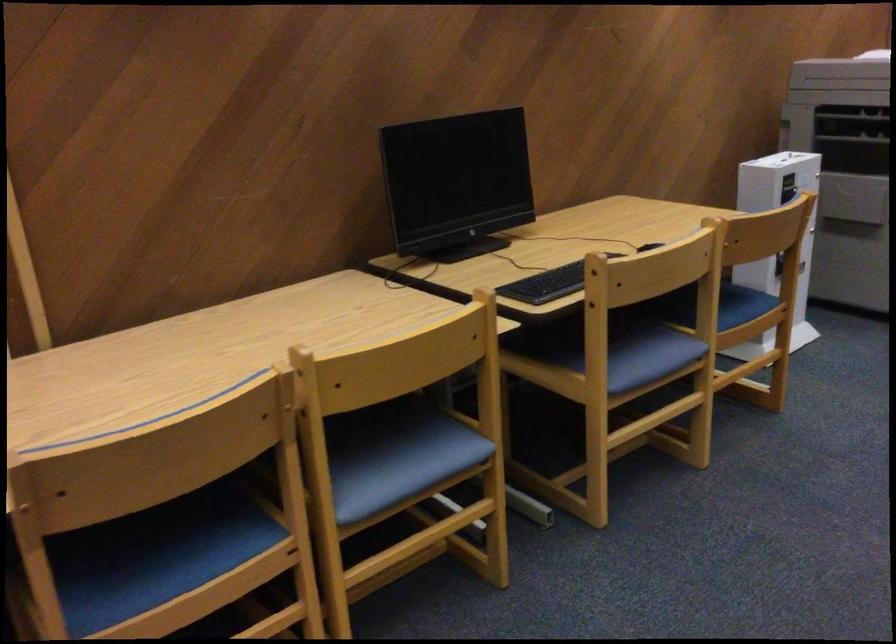
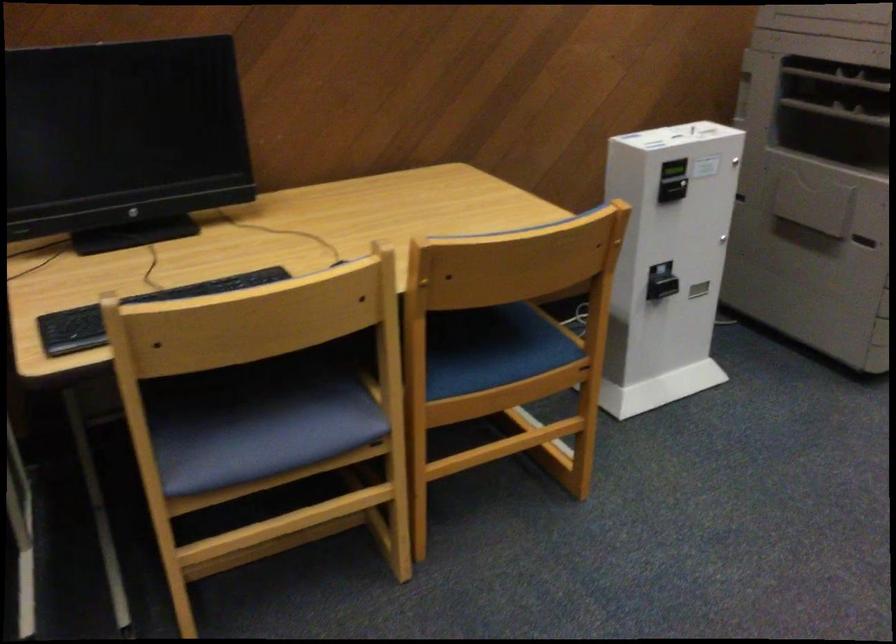
In the second image, find the point that corresponds to point (725, 299) in the first image.

(492, 348)